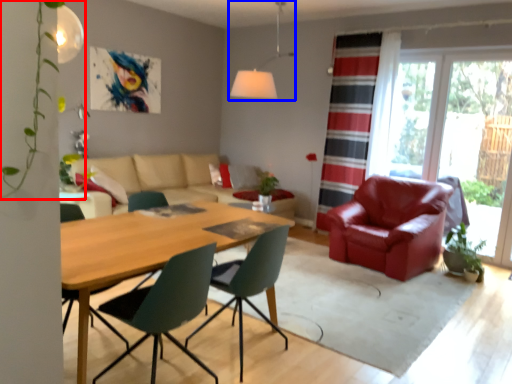
Question: Among these objects, which one is farthest to the camera, plant (highlighted by a red box) or light fixture (highlighted by a blue box)?

Choices:
 (A) plant
 (B) light fixture

Answer: (B)